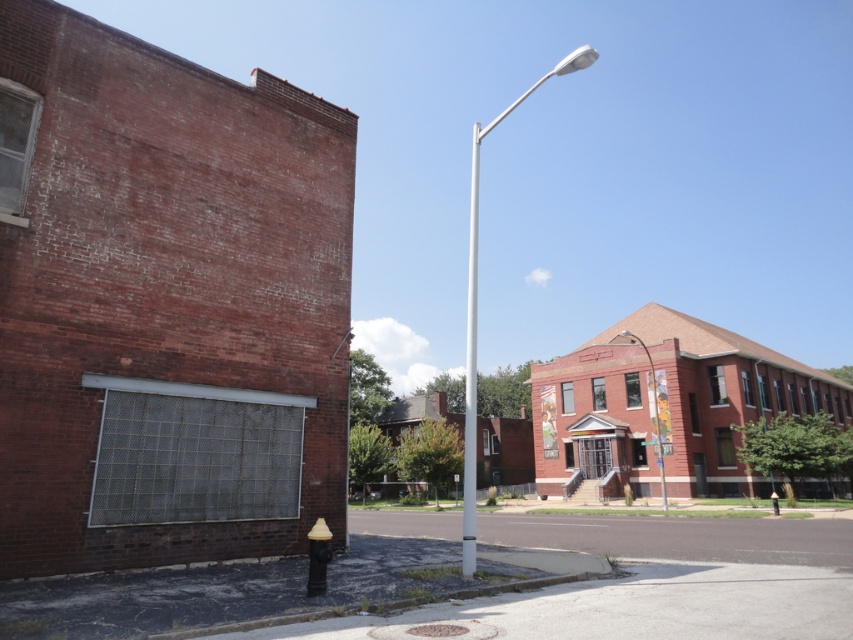
You are a city planner evaluating the urban space. You notice the white metallic pole at center and the metallic streetlight at center. Which object is larger in size?

The white metallic pole at center is bigger than the metallic streetlight at center.

You are standing on the sidewalk and see two points marked on the ground in front of you. The first point is at coordinates point (473, 444) and the second is at point (665, 496). Which point is closer to your current position?

Point (473, 444) is closer to the viewer than point (665, 496), so the first point is closer to your current position.

You are a city planner assessing the street layout. You notice two poles, the white metallic pole at center and the silver metallic pole at center. Which one is taller?

The white metallic pole at center is taller than the silver metallic pole at center according to the description.